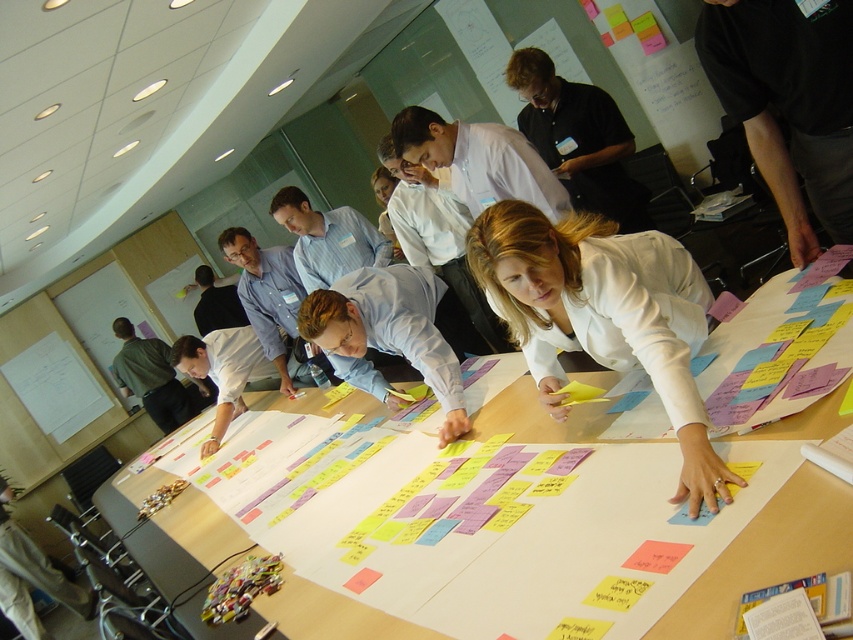
Question: Which object is positioned farthest from the black shirt at upper center?

Choices:
 (A) white paper at center
 (B) white matte shirt at center

Answer: (A)

Question: In this image, where is white matte shirt at center located relative to white paper at center?

Choices:
 (A) below
 (B) above

Answer: (B)

Question: Which is farther from the white matte shirt at center?

Choices:
 (A) white paper at center
 (B) black shirt at upper center

Answer: (B)

Question: Which object appears closest to the camera in this image?

Choices:
 (A) black shirt at upper center
 (B) white paper at center
 (C) white matte shirt at center

Answer: (C)

Question: Considering the relative positions of white paper at center and black shirt at upper center in the image provided, where is white paper at center located with respect to black shirt at upper center?

Choices:
 (A) right
 (B) left

Answer: (B)

Question: Is white matte shirt at center to the right of black shirt at upper center from the viewer's perspective?

Choices:
 (A) yes
 (B) no

Answer: (B)